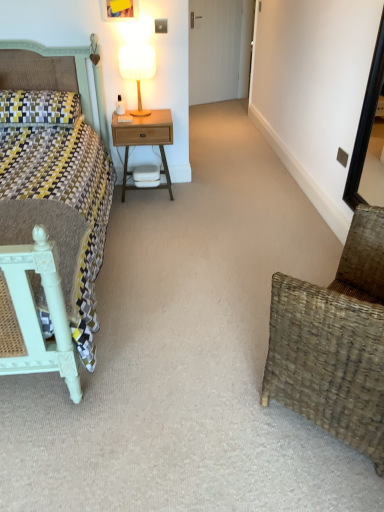
In order to click on vacant area that is in front of white glossy door at upper center in this screenshot , I will do `click(225, 110)`.